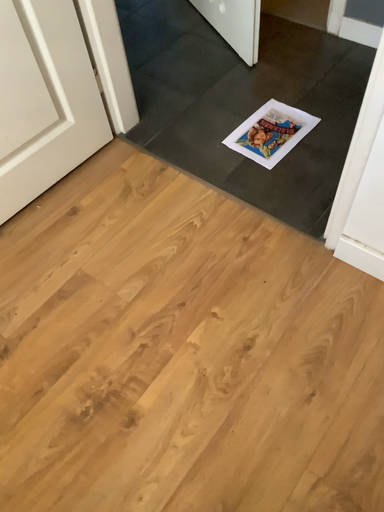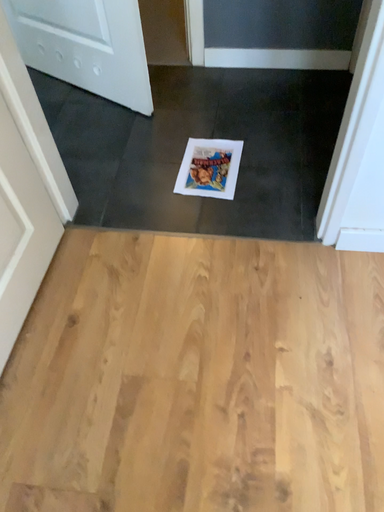
Question: How did the camera likely rotate when shooting the video?

Choices:
 (A) rotated right
 (B) rotated left

Answer: (A)